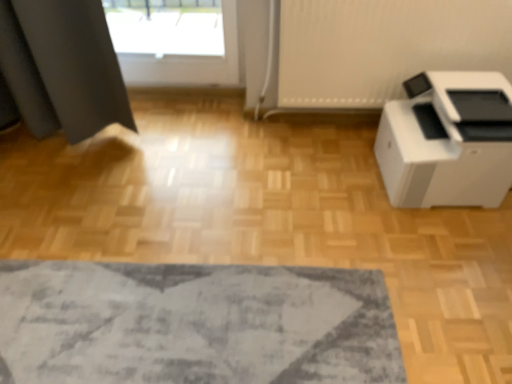
Find the location of a particular element. vacant region to the left of white plastic printer at right is located at coordinates (342, 182).